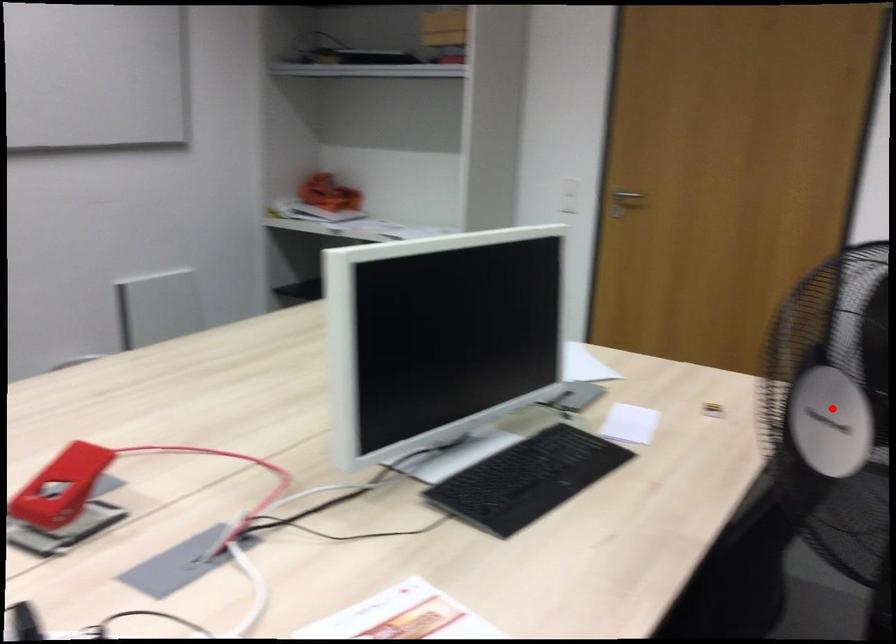
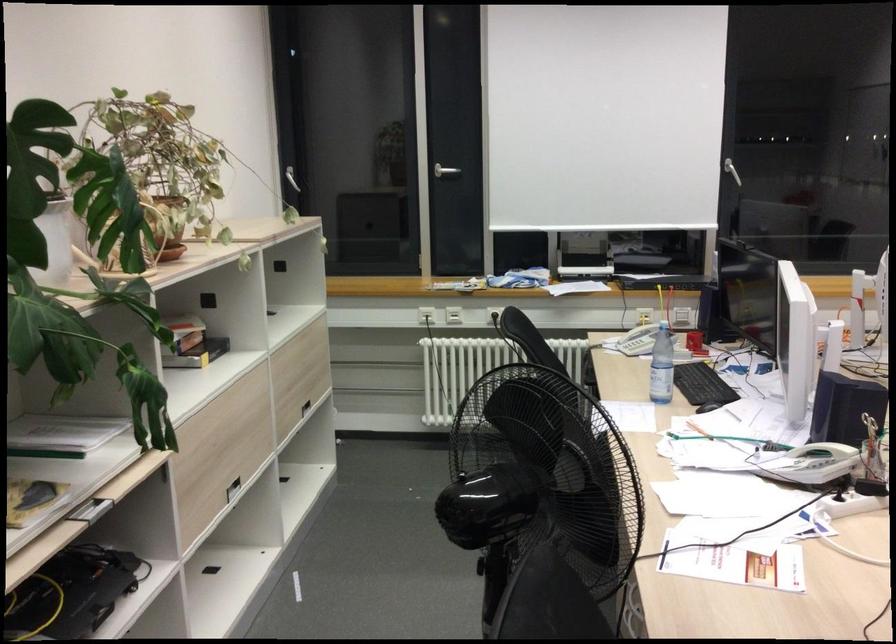
Question: I am providing you with two images of the same scene from different viewpoints. A red point is marked on the first image. At the location where the point appears in image 1, is it still visible in image 2?

Choices:
 (A) Yes
 (B) No

Answer: (B)